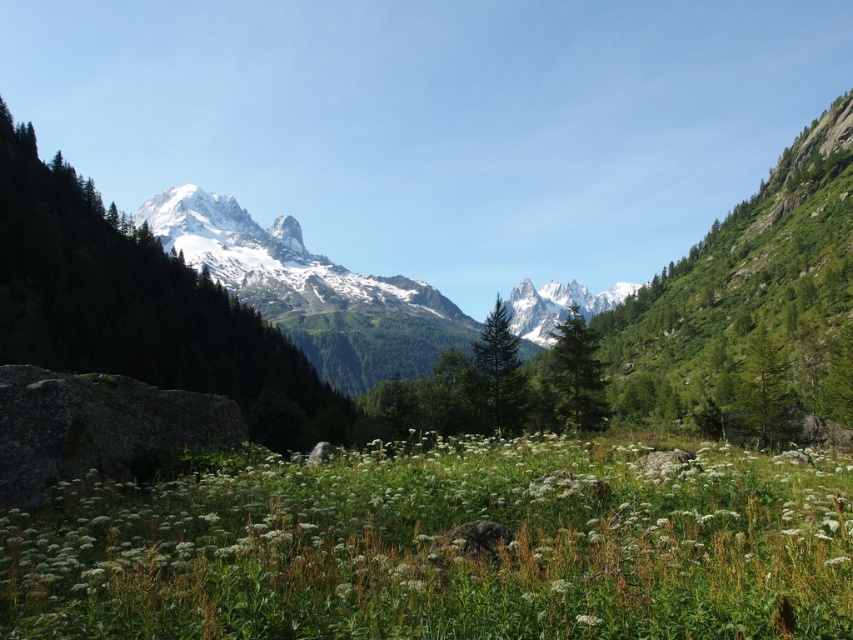
Question: Is green leafy plant at center thinner than white snow-covered mountain range at center?

Choices:
 (A) yes
 (B) no

Answer: (A)

Question: Can you confirm if green leafy plant at center is positioned above white snow-covered mountain range at center?

Choices:
 (A) yes
 (B) no

Answer: (B)

Question: Is green leafy plant at center further to the viewer compared to white snow-covered mountain range at center?

Choices:
 (A) yes
 (B) no

Answer: (B)